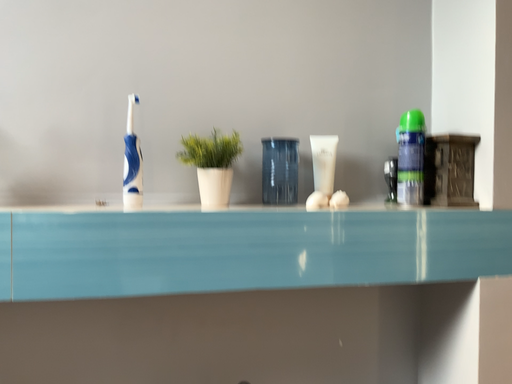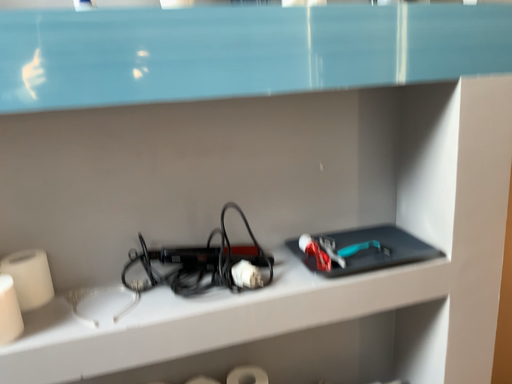
Question: How did the camera likely rotate when shooting the video?

Choices:
 (A) rotated upward
 (B) rotated downward

Answer: (B)